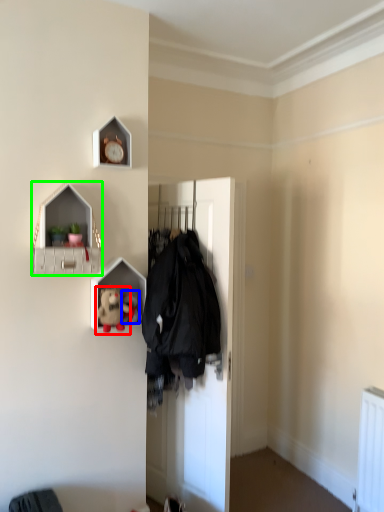
Question: Estimate the real-world distances between objects in this image. Which object is closer to toy (highlighted by a red box), toy (highlighted by a blue box) or shelf (highlighted by a green box)?

Choices:
 (A) toy
 (B) shelf

Answer: (A)